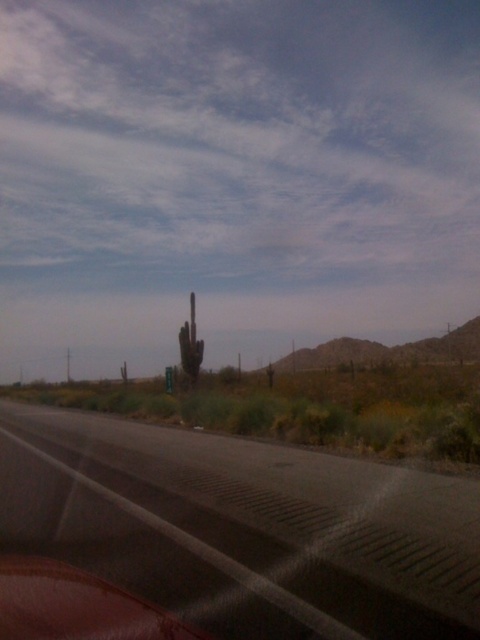
Who is lower down, black asphalt highway at lower center or green spiky cactus at center?

black asphalt highway at lower center

Identify the location of black asphalt highway at lower center. (243, 528).